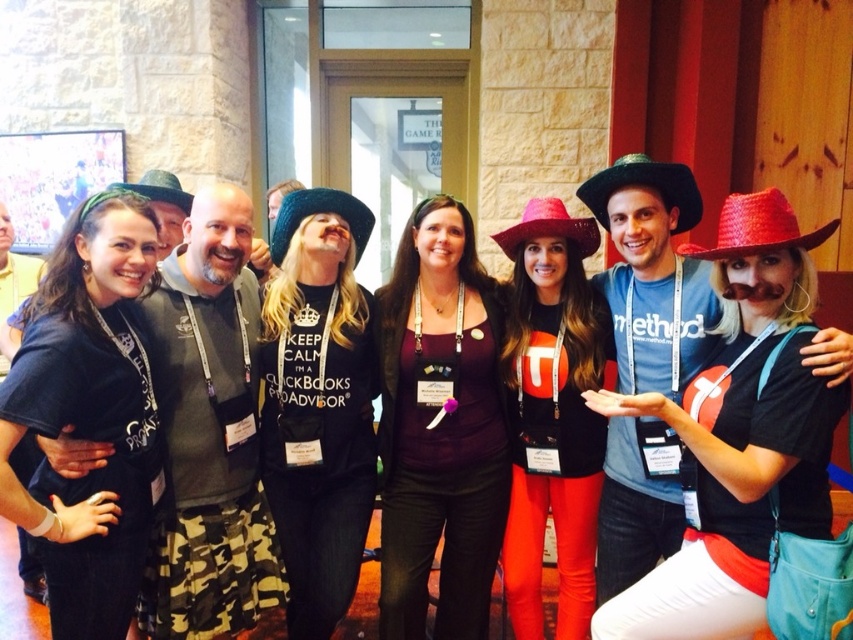
What do you see at coordinates (757, 227) in the screenshot?
I see `red straw cowboy hat at upper right` at bounding box center [757, 227].

Who is shorter, red straw cowboy hat at upper right or red felt cowboy hat at center?

red straw cowboy hat at upper right is shorter.

What do you see at coordinates (757, 227) in the screenshot? The width and height of the screenshot is (853, 640). I see `red straw cowboy hat at upper right` at bounding box center [757, 227].

Locate an element on the screen. red straw cowboy hat at upper right is located at coordinates (757, 227).

Which is below, red straw cowboy hat at upper right or black knitted cowboy hat at center?

red straw cowboy hat at upper right is below.

What do you see at coordinates (757, 227) in the screenshot? I see `red straw cowboy hat at upper right` at bounding box center [757, 227].

This screenshot has width=853, height=640. I want to click on red straw cowboy hat at upper right, so click(x=757, y=227).

In the scene shown: Does green felt cowboy hat at center have a smaller size compared to black felt cowboy hat at upper left?

Indeed, green felt cowboy hat at center has a smaller size compared to black felt cowboy hat at upper left.

Is green felt cowboy hat at center wider than black felt cowboy hat at upper left?

Yes.

Is point (686, 202) positioned after point (187, 211)?

No, (686, 202) is closer to viewer.

The image size is (853, 640). What are the coordinates of `green felt cowboy hat at center` in the screenshot? It's located at (643, 186).